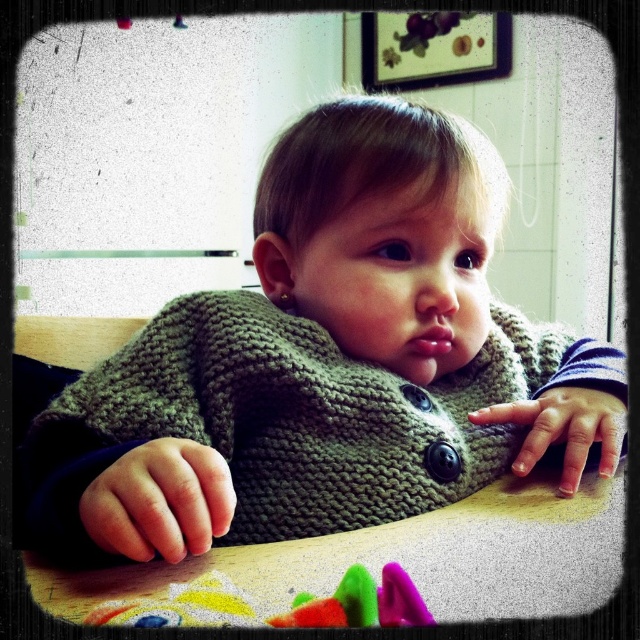
Can you confirm if knitted green sweater at center is positioned to the right of knitted fabric hand at center?

In fact, knitted green sweater at center is to the left of knitted fabric hand at center.

Does knitted green sweater at center have a greater width compared to knitted fabric hand at center?

Yes.

This screenshot has width=640, height=640. What do you see at coordinates (326, 364) in the screenshot?
I see `knitted green sweater at center` at bounding box center [326, 364].

Find the location of a particular element. The width and height of the screenshot is (640, 640). knitted green sweater at center is located at coordinates (326, 364).

Does point (214, 452) lie behind point (577, 445)?

No, it is not.

Which is behind, point (90, 509) or point (611, 440)?

The point (611, 440) is behind.

I want to click on smooth skin hand at center, so click(x=160, y=500).

Is smooth skin hand at center above rubberized plastic toy at lower center?

Yes, smooth skin hand at center is above rubberized plastic toy at lower center.

Is point (97, 477) more distant than point (412, 611)?

Yes, it is.

Is point (122, 499) closer to viewer compared to point (381, 614)?

No, (122, 499) is behind (381, 614).

I want to click on smooth skin hand at center, so click(x=160, y=500).